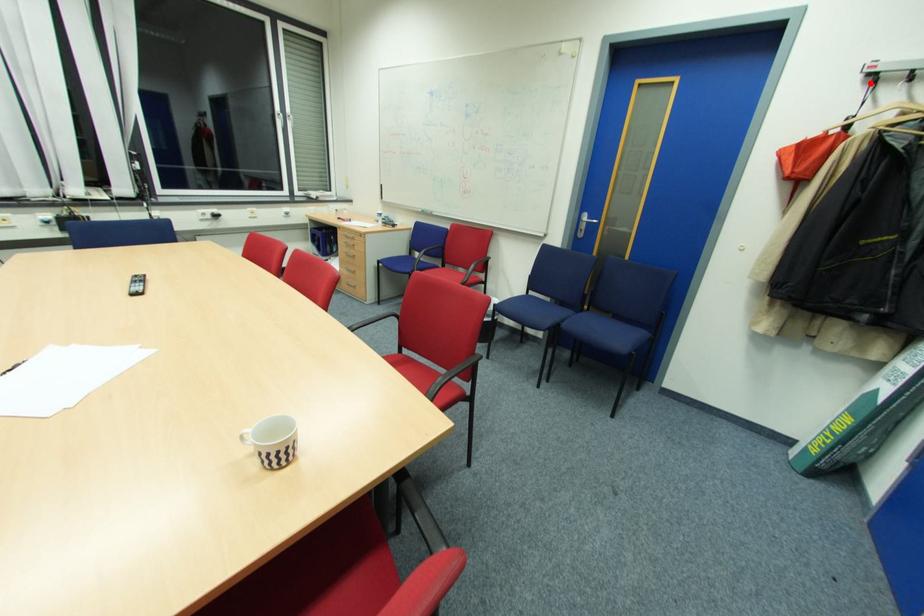
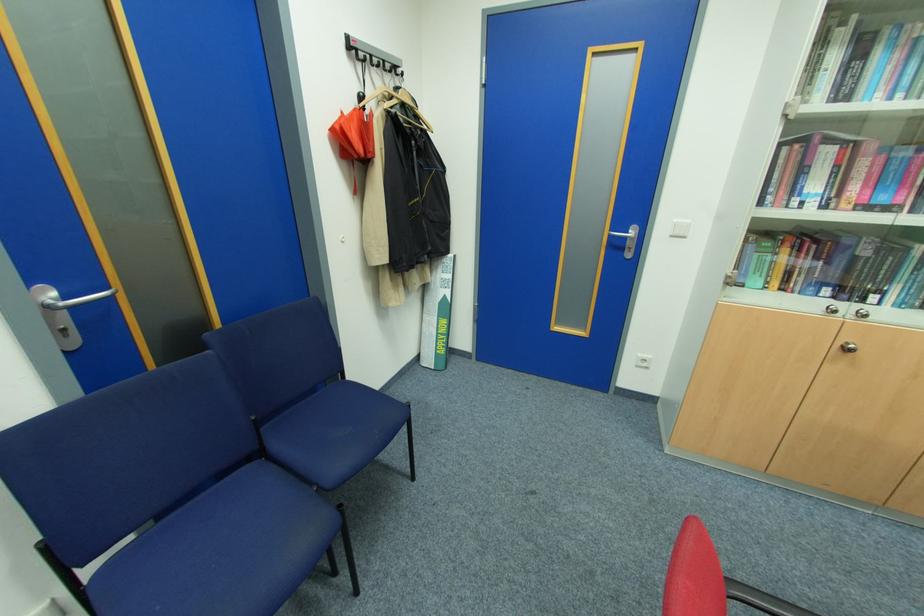
Question: A red point is marked in image1. In image2, is the corresponding 3D point closer to the camera or farther? Reply with the corresponding letter.

Choices:
 (A) The corresponding 3D point is closer.
 (B) The corresponding 3D point is farther.

Answer: (A)